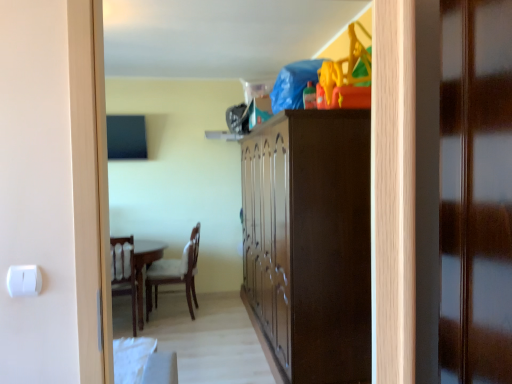
Where is `dark wood cabinet at center`? This screenshot has height=384, width=512. dark wood cabinet at center is located at coordinates (309, 243).

Image resolution: width=512 pixels, height=384 pixels. What do you see at coordinates (309, 243) in the screenshot? I see `dark wood cabinet at center` at bounding box center [309, 243].

Describe the element at coordinates (442, 192) in the screenshot. I see `wooden door at right` at that location.

Locate an element on the screen. wooden door at right is located at coordinates (442, 192).

Measure the distance between wooden door at right and camera.

The depth of wooden door at right is 80.36 centimeters.

Locate an element on the screen. dark wood cabinet at center is located at coordinates (309, 243).

Considering the relative positions of wooden door at right and dark wood cabinet at center in the image provided, is wooden door at right to the left or to the right of dark wood cabinet at center?

Based on their positions, wooden door at right is located to the right of dark wood cabinet at center.

Between wooden door at right and dark wood cabinet at center, which one is positioned behind?

dark wood cabinet at center.

Does point (403, 73) come farther from viewer compared to point (324, 110)?

No, it is not.

From the image's perspective, is wooden door at right above or below dark wood cabinet at center?

From the image's perspective, wooden door at right appears above dark wood cabinet at center.

From a real-world perspective, is wooden door at right over dark wood cabinet at center?

Correct, in the physical world, wooden door at right is higher than dark wood cabinet at center.

Between wooden door at right and dark wood cabinet at center, which one has larger width?

With larger width is dark wood cabinet at center.

From their relative heights in the image, would you say wooden door at right is taller or shorter than dark wood cabinet at center?

In the image, wooden door at right appears to be shorter than dark wood cabinet at center.

Considering the relative sizes of wooden door at right and dark wood cabinet at center in the image provided, is wooden door at right bigger than dark wood cabinet at center?

Actually, wooden door at right might be smaller than dark wood cabinet at center.

Is wooden door at right inside the boundaries of dark wood cabinet at center, or outside?

wooden door at right is not enclosed by dark wood cabinet at center.

Can you see wooden door at right touching dark wood cabinet at center?

They are not placed beside each other.

Is wooden door at right facing towards dark wood cabinet at center?

No.

This screenshot has height=384, width=512. Identify the location of door on the right of dark wood cabinet at center. (442, 192).

Can you confirm if dark wood cabinet at center is positioned to the right of wooden door at right?

No.

Is dark wood cabinet at center in front of or behind wooden door at right in the image?

Visually, dark wood cabinet at center is located behind wooden door at right.

Considering the positions of point (263, 123) and point (502, 317), is point (263, 123) closer or farther from the camera than point (502, 317)?

Clearly, point (263, 123) is more distant from the camera than point (502, 317).

From the image's perspective, relative to wooden door at right, is dark wood cabinet at center above or below?

dark wood cabinet at center is situated lower than wooden door at right in the image.

From a real-world perspective, relative to wooden door at right, is dark wood cabinet at center vertically above or below?

In terms of real-world spatial position, dark wood cabinet at center is below wooden door at right.

Can you confirm if dark wood cabinet at center is wider than wooden door at right?

Yes.

Considering the sizes of dark wood cabinet at center and wooden door at right in the image, is dark wood cabinet at center taller or shorter than wooden door at right?

dark wood cabinet at center is taller than wooden door at right.

Considering the sizes of objects dark wood cabinet at center and wooden door at right in the image provided, who is smaller, dark wood cabinet at center or wooden door at right?

wooden door at right is smaller.

Is dark wood cabinet at center outside of wooden door at right?

Indeed, dark wood cabinet at center is completely outside wooden door at right.

Would you say dark wood cabinet at center is a long distance from wooden door at right?

dark wood cabinet at center is positioned a significant distance from wooden door at right.

Does dark wood cabinet at center turn towards wooden door at right?

No.

The height and width of the screenshot is (384, 512). I want to click on cabinetry that appears on the left of wooden door at right, so click(309, 243).

Image resolution: width=512 pixels, height=384 pixels. Find the location of `cabinetry below the wooden door at right (from a real-world perspective)`. cabinetry below the wooden door at right (from a real-world perspective) is located at coordinates (309, 243).

The image size is (512, 384). What are the coordinates of `cabinetry lying below the wooden door at right (from the image's perspective)` in the screenshot? It's located at (309, 243).